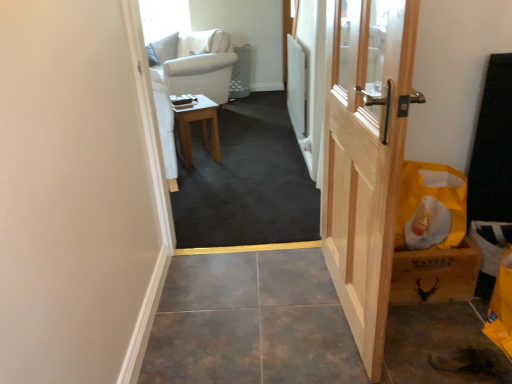
The width and height of the screenshot is (512, 384). I want to click on free space to the left of natural wood door at right, so click(x=253, y=308).